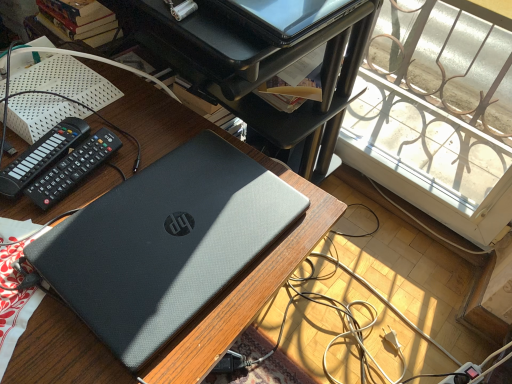
Question: Are sleek black laptop at upper center and black plastic remote at left, which ranks as the 2th control in right-to-left order, beside each other?

Choices:
 (A) no
 (B) yes

Answer: (A)

Question: Is sleek black laptop at upper center closer to camera compared to black plastic remote at left, which appears as the 1th control when viewed from the left?

Choices:
 (A) yes
 (B) no

Answer: (B)

Question: From the image's perspective, does sleek black laptop at upper center appear higher than black plastic remote at left, which appears as the 1th control when viewed from the left?

Choices:
 (A) yes
 (B) no

Answer: (A)

Question: Are sleek black laptop at upper center and black plastic remote at left, which appears as the 1th control when viewed from the left, located far from each other?

Choices:
 (A) yes
 (B) no

Answer: (B)

Question: Is sleek black laptop at upper center at the left side of black plastic remote at left, which ranks as the 2th control in right-to-left order?

Choices:
 (A) no
 (B) yes

Answer: (A)

Question: Considering the relative sizes of sleek black laptop at upper center and black plastic remote at left, which appears as the 1th control when viewed from the left, in the image provided, is sleek black laptop at upper center smaller than black plastic remote at left, which appears as the 1th control when viewed from the left,?

Choices:
 (A) no
 (B) yes

Answer: (A)

Question: Considering the relative sizes of matte black laptop at center and black plastic remote at left, which ranks as the 2th control in right-to-left order, in the image provided, is matte black laptop at center shorter than black plastic remote at left, which ranks as the 2th control in right-to-left order,?

Choices:
 (A) yes
 (B) no

Answer: (B)

Question: Is matte black laptop at center taller than black plastic remote at left, which appears as the 1th control when viewed from the left?

Choices:
 (A) yes
 (B) no

Answer: (A)

Question: Is matte black laptop at center closer to the viewer compared to black plastic remote at left, which appears as the 1th control when viewed from the left?

Choices:
 (A) no
 (B) yes

Answer: (B)

Question: Is matte black laptop at center far away from black plastic remote at left, which ranks as the 2th control in right-to-left order?

Choices:
 (A) yes
 (B) no

Answer: (B)

Question: Can you confirm if matte black laptop at center is positioned to the left of black plastic remote at left, which appears as the 1th control when viewed from the left?

Choices:
 (A) yes
 (B) no

Answer: (B)

Question: Does matte black laptop at center have a lesser width compared to black plastic remote at left, which ranks as the 2th control in right-to-left order?

Choices:
 (A) yes
 (B) no

Answer: (B)

Question: Could you tell me if black plastic remote at left, which ranks as the 2th control in right-to-left order, is facing sleek black laptop at upper center?

Choices:
 (A) yes
 (B) no

Answer: (B)